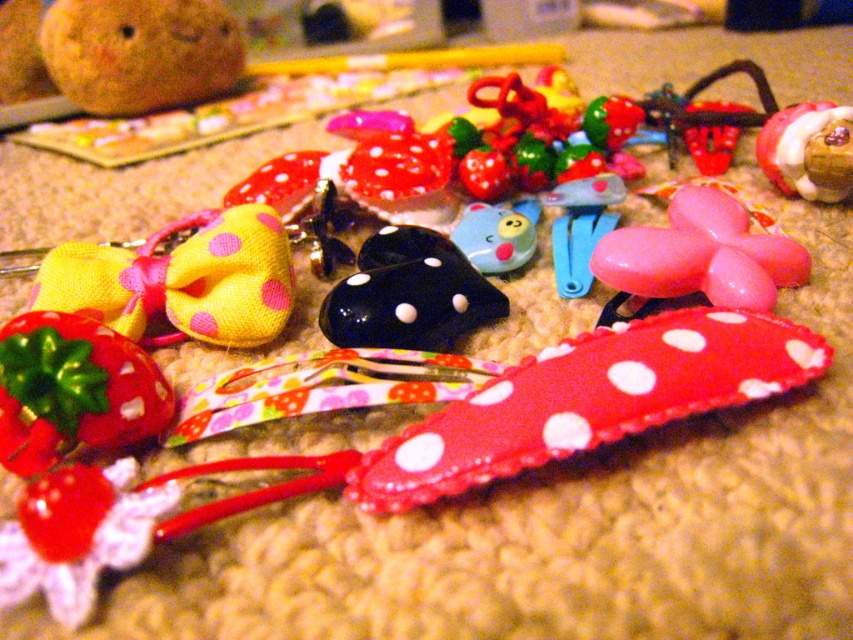
Question: Can you confirm if matte red fabric bow at upper left is positioned above black glossy heart at center?

Choices:
 (A) yes
 (B) no

Answer: (B)

Question: Which object is the farthest from the black glossy heart at center?

Choices:
 (A) blue rubber duck at center
 (B) yellow fabric bow at left

Answer: (B)

Question: Is black glossy heart at center wider than matte brown wooden toy at upper right?

Choices:
 (A) no
 (B) yes

Answer: (B)

Question: Which object is closer to the camera taking this photo?

Choices:
 (A) blue rubber duck at center
 (B) matte red fabric bow at upper left

Answer: (B)

Question: Which object appears farthest from the camera in this image?

Choices:
 (A) blue rubber duck at center
 (B) blue plastic clip at center

Answer: (A)

Question: Is blue plastic clip at center above blue rubber duck at center?

Choices:
 (A) no
 (B) yes

Answer: (B)